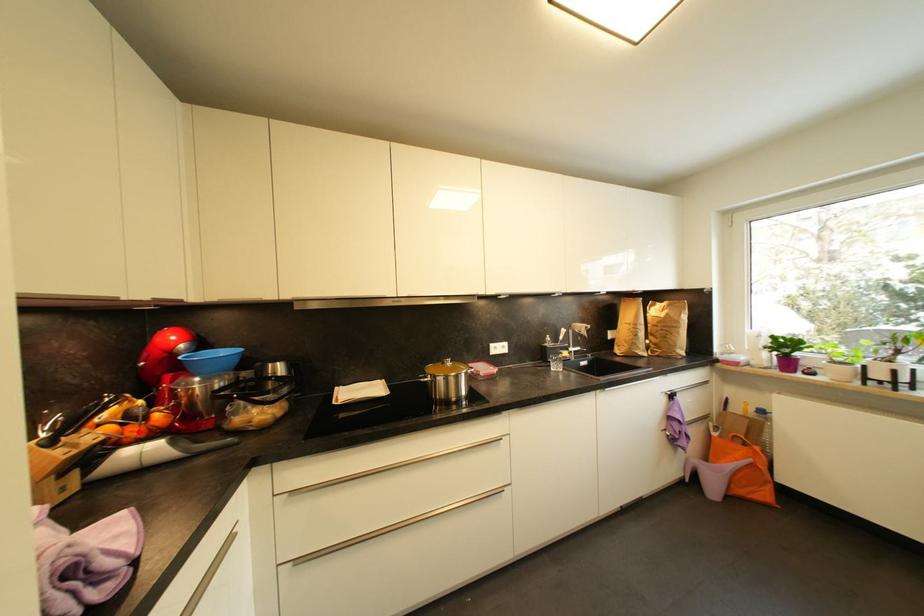
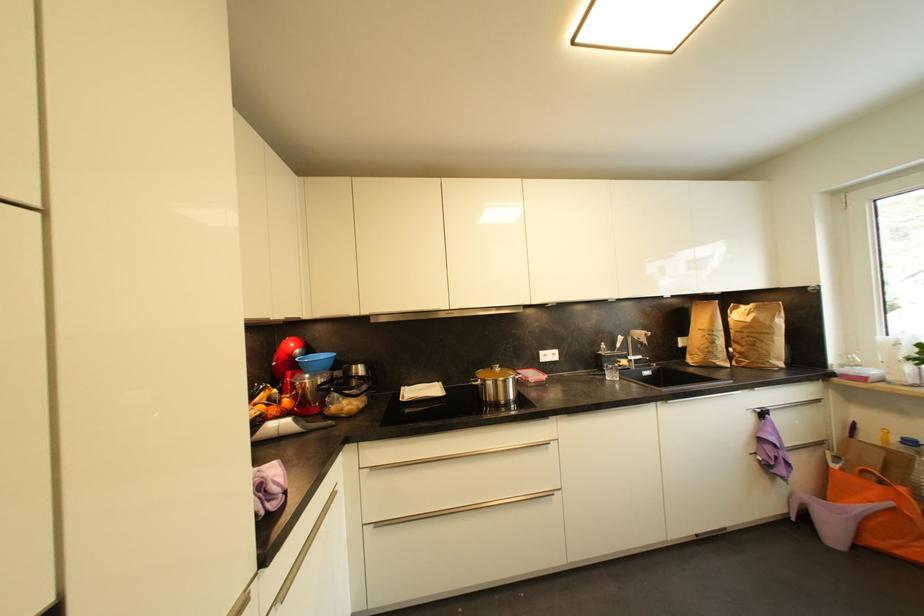
In the second image, find the point that corresponds to the highlighted location in the first image.

(277, 411)